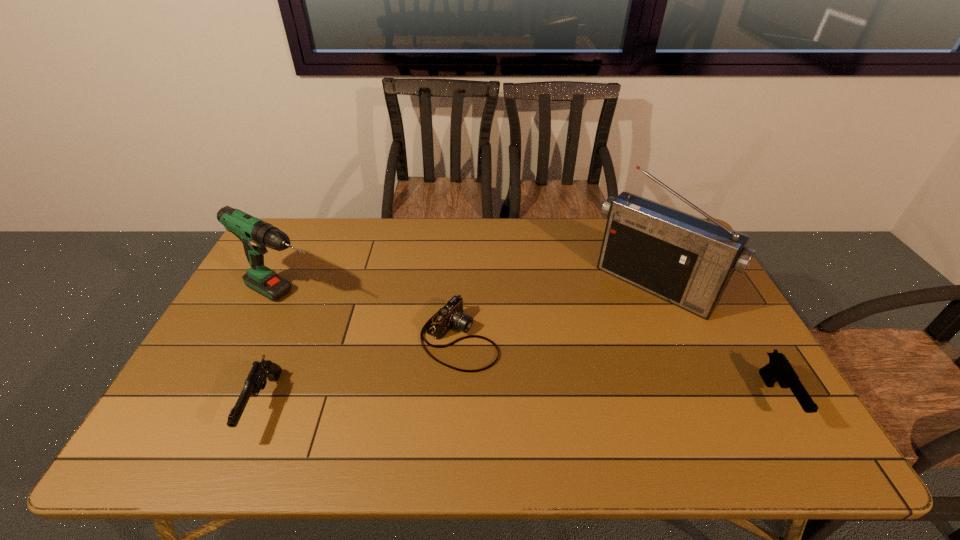
At what (x,y) coordinates should I click in order to perform the action: click on free spot on the desktop that is between the gun and the pistol and is positioned on the handle side of the fourth shortest object. Please return your answer as a coordinate pair (x, y). The width and height of the screenshot is (960, 540). Looking at the image, I should click on (476, 402).

This screenshot has height=540, width=960. In order to click on vacant space on the desktop that is between the gun and the pistol and is positioned on the front-facing side of the radio receiver in this screenshot , I will do `click(557, 401)`.

What are the coordinates of `free space on the desktop that is between the gun and the pistol and is positioned on the front-facing side of the camera` in the screenshot? It's located at (582, 401).